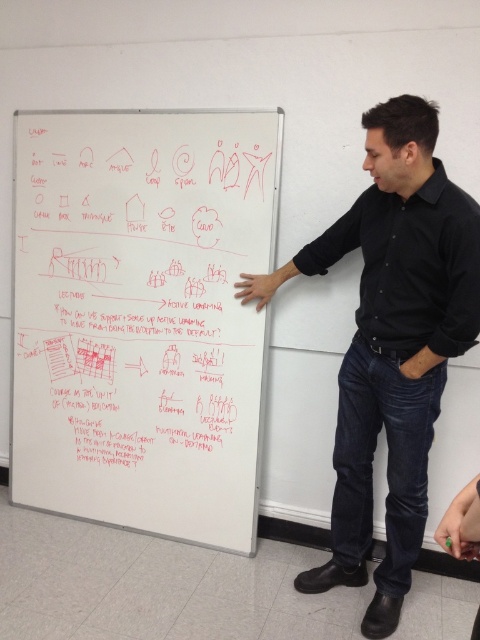
Does whiteboard at center have a lesser width compared to black shirt at center?

No.

Does whiteboard at center appear on the left side of black shirt at center?

Indeed, whiteboard at center is positioned on the left side of black shirt at center.

Locate an element on the screen. The width and height of the screenshot is (480, 640). whiteboard at center is located at coordinates coord(141,316).